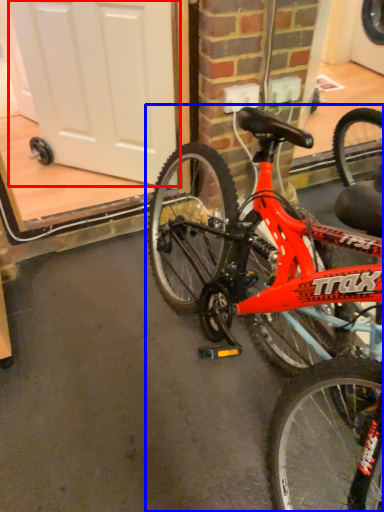
Question: Which object appears closest to the camera in this image, screen door (highlighted by a red box) or bicycle (highlighted by a blue box)?

Choices:
 (A) screen door
 (B) bicycle

Answer: (B)